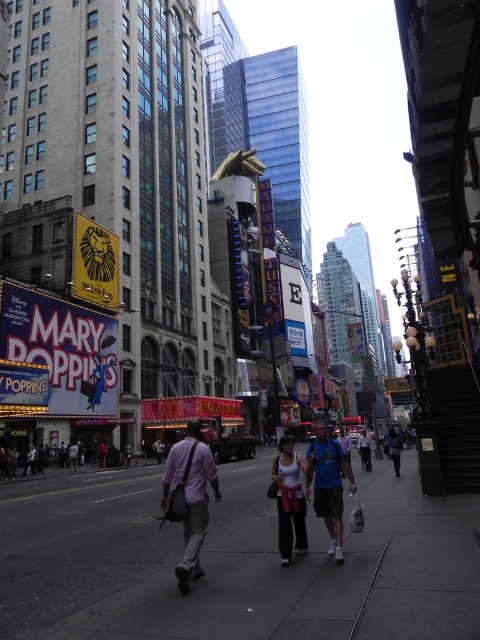
Find the location of a particular element. This screenshot has height=640, width=480. light purple shirt at center is located at coordinates (189, 497).

Measure the distance from light purple shirt at center to matte pink tank top at center.

light purple shirt at center and matte pink tank top at center are 5.49 meters apart.

Does point (196, 515) lie behind point (288, 472)?

No, (196, 515) is in front of (288, 472).

At what (x,y) coordinates should I click in order to perform the action: click on light purple shirt at center. Please return your answer as a coordinate pair (x, y). The image size is (480, 640). Looking at the image, I should click on (189, 497).

Is blue fabric shirt at center positioned before blue denim jeans at center?

Yes, it is.

What do you see at coordinates (327, 483) in the screenshot?
I see `blue fabric shirt at center` at bounding box center [327, 483].

Is point (338, 525) in front of point (362, 433)?

Yes, it is.

Locate an element on the screen. The height and width of the screenshot is (640, 480). blue fabric shirt at center is located at coordinates (327, 483).

Consider the image. Which of these two, light purple shirt at center or blue fabric backpack at center, stands shorter?

With less height is blue fabric backpack at center.

Based on the photo, which of these two, light purple shirt at center or blue fabric backpack at center, stands taller?

Standing taller between the two is light purple shirt at center.

This screenshot has height=640, width=480. Find the location of `light purple shirt at center`. light purple shirt at center is located at coordinates (189, 497).